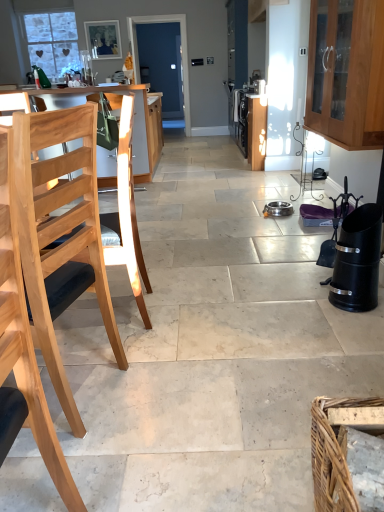
The width and height of the screenshot is (384, 512). I want to click on vacant area situated below natural wood chair at left (from a real-world perspective), so click(83, 389).